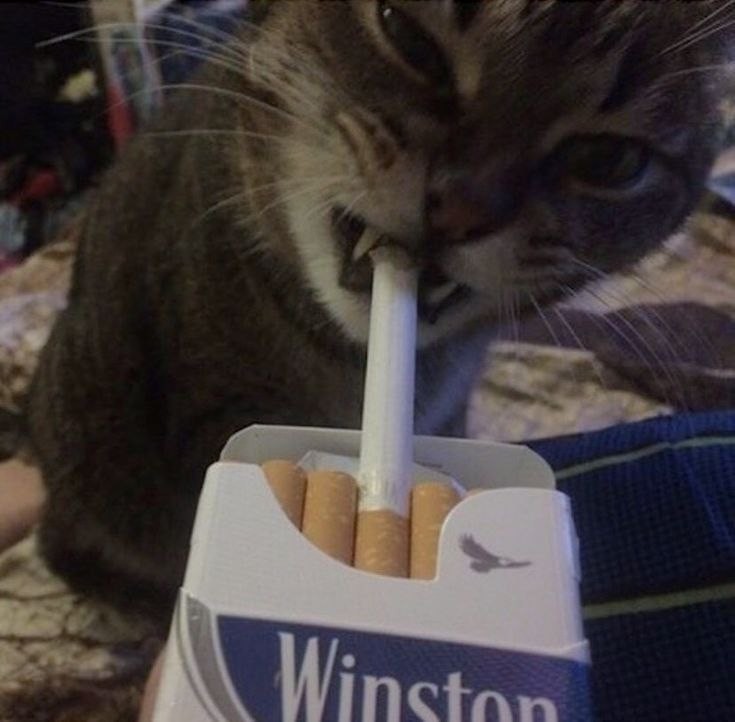
Identify the location of cigarette box. point(473,656).